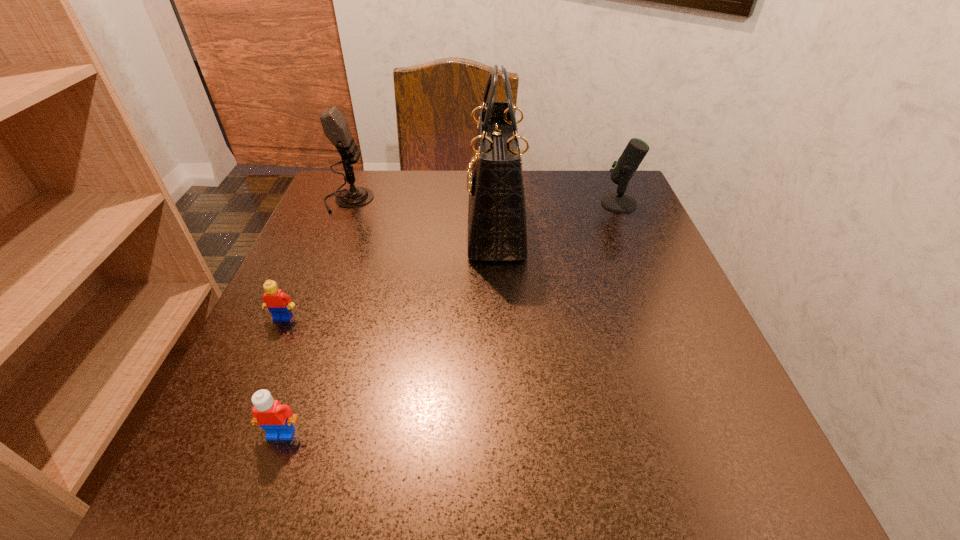
You are a GUI agent. You are given a task and a screenshot of the screen. Output one action in this format:
    pyautogui.click(x=<x>, y=<y>)
    Task: Click on the free space located at the front of the tallest object with visible charms
    The width and height of the screenshot is (960, 540).
    Given the screenshot: What is the action you would take?
    pyautogui.click(x=344, y=227)

Find the location of a particular element. The width and height of the screenshot is (960, 540). free space located 0.320m at the front of the tallest object with visible charms is located at coordinates (321, 227).

At what (x,y) coordinates should I click in order to perform the action: click on free location located at the front of the tallest object with visible charms. Please return your answer as a coordinate pair (x, y). The image size is (960, 540). Looking at the image, I should click on click(x=321, y=227).

Where is `vacant space situated 0.390m on the front-facing side of the fourth shortest object`? The image size is (960, 540). vacant space situated 0.390m on the front-facing side of the fourth shortest object is located at coordinates (540, 200).

The image size is (960, 540). I want to click on vacant space located on the back of the right microphone, so click(x=610, y=181).

Where is `free region located on the face of the nearer Lego`? The image size is (960, 540). free region located on the face of the nearer Lego is located at coordinates (262, 487).

You are a GUI agent. You are given a task and a screenshot of the screen. Output one action in this format:
    pyautogui.click(x=<x>, y=<y>)
    Task: Click on the blank space located 0.270m on the face of the left Lego
    This screenshot has width=960, height=540.
    Given the screenshot: What is the action you would take?
    pyautogui.click(x=209, y=483)

Find the location of a particular element. The image size is (960, 540). handbag that is at the far edge is located at coordinates point(497,229).

Where is `object situated at the near edge`? This screenshot has height=540, width=960. object situated at the near edge is located at coordinates (277, 419).

You are a GUI agent. You are given a task and a screenshot of the screen. Output one action in this format:
    pyautogui.click(x=<x>, y=<y>)
    Task: Click on the microphone located in the left edge section of the desktop
    
    Given the screenshot: What is the action you would take?
    pyautogui.click(x=336, y=129)